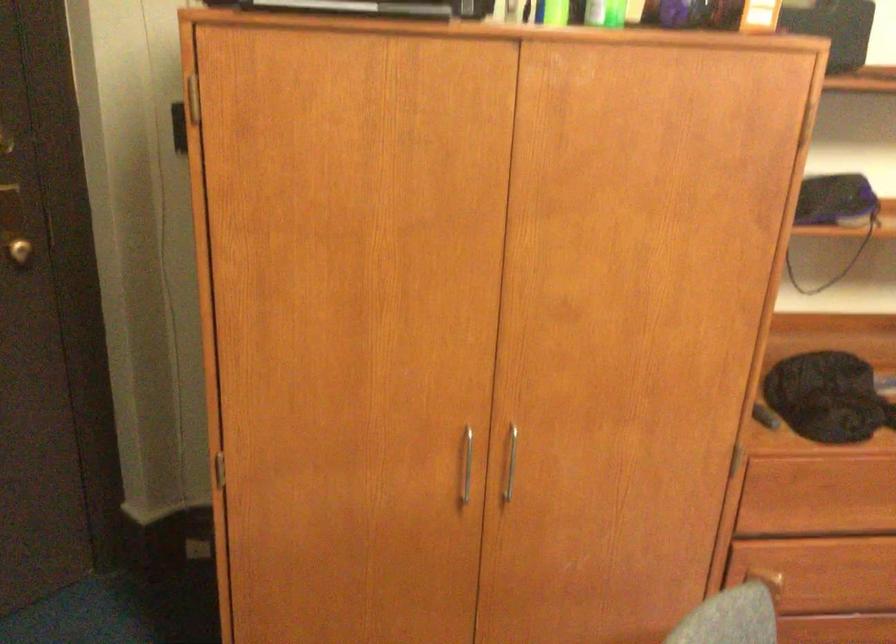
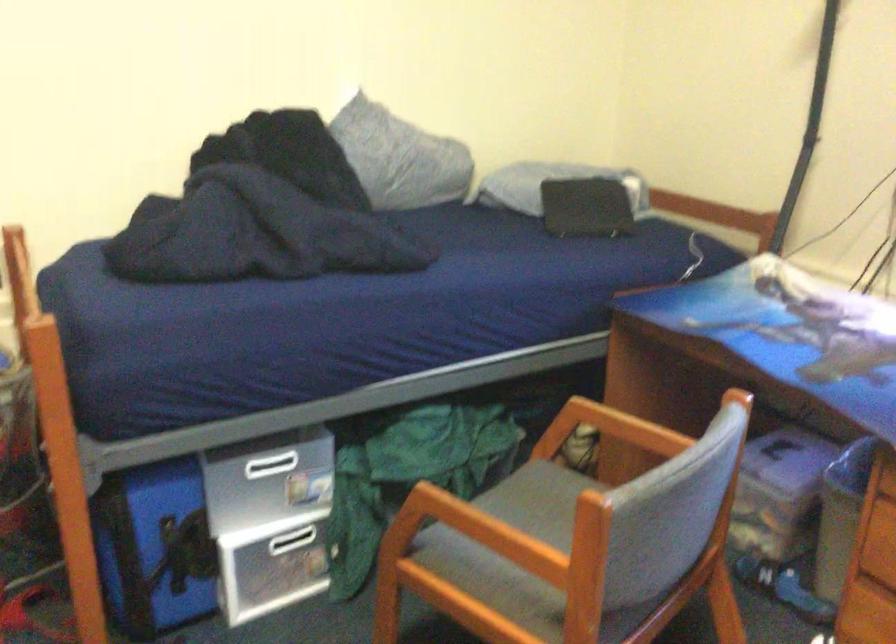
Question: The images are taken continuously from a first-person perspective. In which direction is your viewpoint rotating?

Choices:
 (A) Left
 (B) Right
 (C) Up
 (D) Down

Answer: (B)